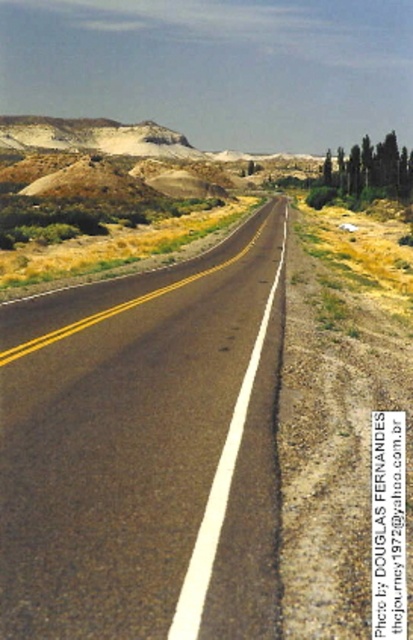
Question: Among these points, which one is nearest to the camera?

Choices:
 (A) (360, 189)
 (B) (4, 412)

Answer: (B)

Question: Is black asphalt road at center above green textured cypress trees at right?

Choices:
 (A) no
 (B) yes

Answer: (A)

Question: Can you confirm if black asphalt road at center is positioned to the left of green textured cypress trees at right?

Choices:
 (A) no
 (B) yes

Answer: (B)

Question: Observing the image, what is the correct spatial positioning of black asphalt road at center in reference to green textured cypress trees at right?

Choices:
 (A) right
 (B) left

Answer: (B)

Question: Which point is farther to the camera?

Choices:
 (A) green textured cypress trees at right
 (B) black asphalt road at center

Answer: (A)